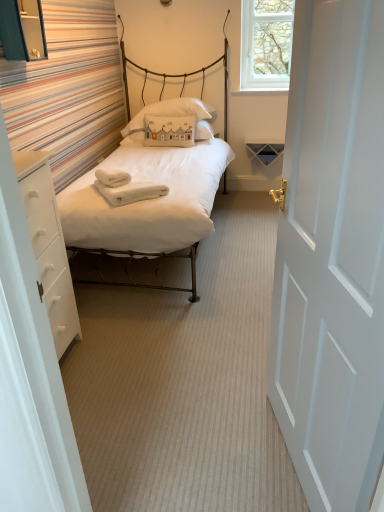
This screenshot has height=512, width=384. What are the coordinates of `vacant space to the right of white matte drawer at left` in the screenshot? It's located at (114, 366).